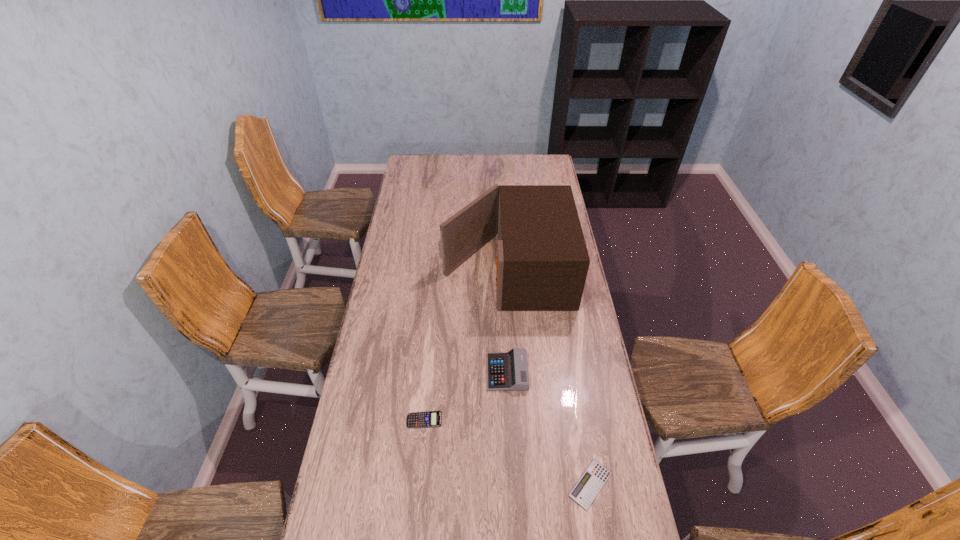
At what (x,y) coordinates should I click in order to perform the action: click on the farthest object. Please return your answer as a coordinate pair (x, y). This screenshot has height=540, width=960. Looking at the image, I should click on point(542,262).

Where is `microwave oven`? microwave oven is located at coordinates (542, 262).

I want to click on the second farthest object, so click(x=508, y=371).

Where is `the tallest calculator`? the tallest calculator is located at coordinates tap(508, 371).

Identify the location of the second shortest object. (428, 419).

Identify the location of the leftmost calculator. The image size is (960, 540). (428, 419).

Find the location of a particular element. the rightmost calculator is located at coordinates (587, 488).

At what (x,y) coordinates should I click in order to perform the action: click on the nearest calculator. Please return your answer as a coordinate pair (x, y). The height and width of the screenshot is (540, 960). Looking at the image, I should click on tap(587, 488).

Locate an element on the screen. The height and width of the screenshot is (540, 960). vacant space located 0.190m with the door open on the front of the tallest object is located at coordinates (398, 269).

Where is `free space located 0.170m with the door open on the front of the tallest object`? free space located 0.170m with the door open on the front of the tallest object is located at coordinates (403, 269).